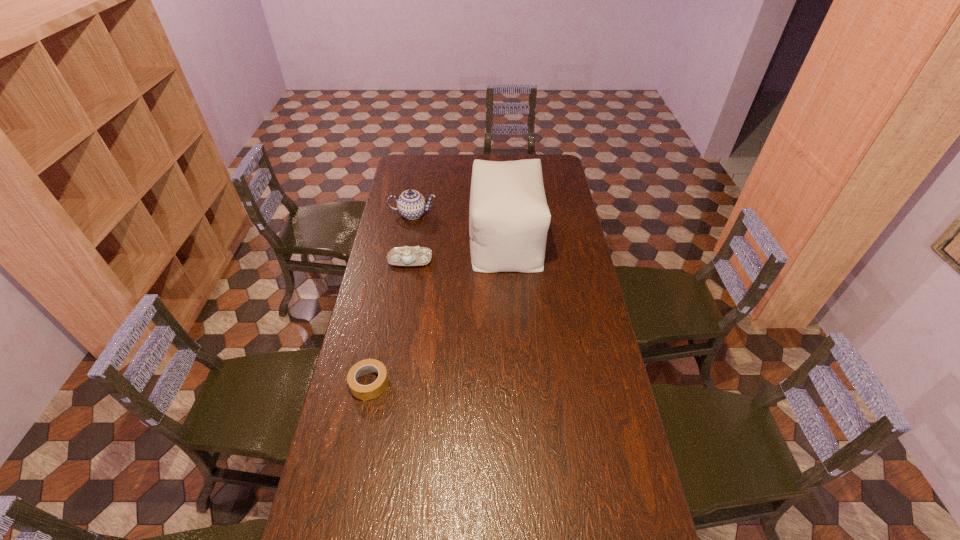
Locate an element on the screen. the closest object to the duct tape is located at coordinates (402, 256).

You are a GUI agent. You are given a task and a screenshot of the screen. Output one action in this format:
    pyautogui.click(x=<x>, y=<y>)
    Task: Click on the free spot that satisfies the following two spatial constraints: 1. at the spout of the third shortest object; 2. on the left side of the nearer chinaware
    This screenshot has height=540, width=960.
    Given the screenshot: What is the action you would take?
    pyautogui.click(x=405, y=259)

Identify the location of vacant space that satisfies the following two spatial constraints: 1. at the spout of the farther chinaware; 2. on the right side of the second shortest object. (405, 259).

This screenshot has height=540, width=960. Find the location of `free spot that satisfies the following two spatial constraints: 1. at the spout of the taller chinaware; 2. on the left side of the third tallest object`. free spot that satisfies the following two spatial constraints: 1. at the spout of the taller chinaware; 2. on the left side of the third tallest object is located at coordinates pos(405,259).

Image resolution: width=960 pixels, height=540 pixels. Identify the location of vacant space that satisfies the following two spatial constraints: 1. on the side of the tallest object with the smiley face; 2. at the edge of the shortest object. click(516, 384).

In order to click on free space that satisfies the following two spatial constraints: 1. at the spout of the farther chinaware; 2. on the left side of the nearer chinaware in this screenshot , I will do `click(405, 259)`.